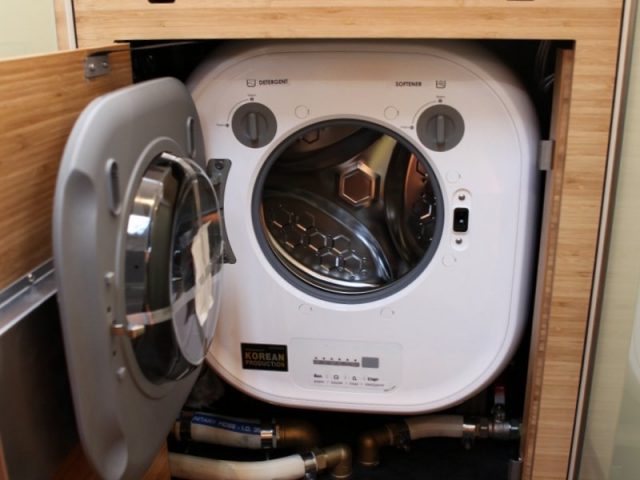
This screenshot has width=640, height=480. I want to click on door clip latch, so click(458, 218).